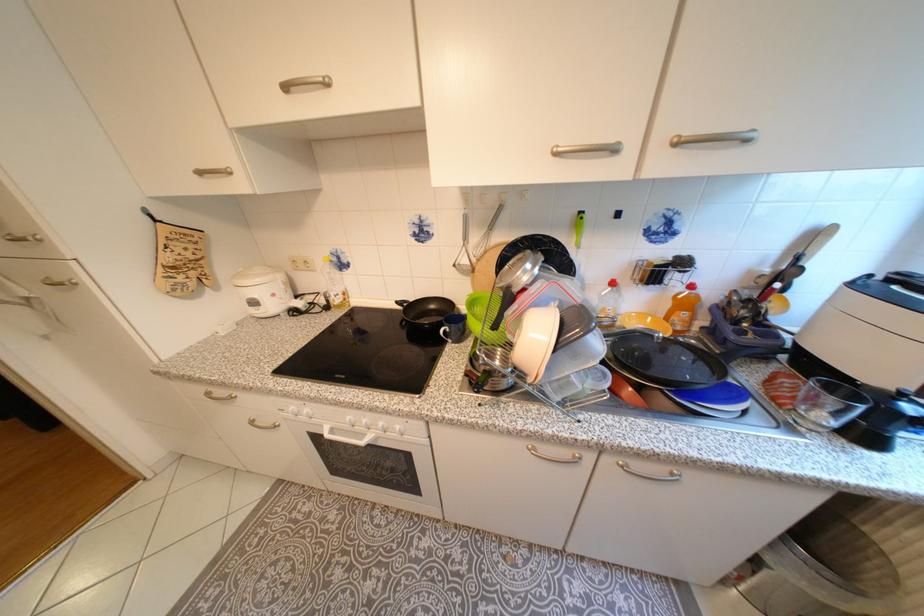
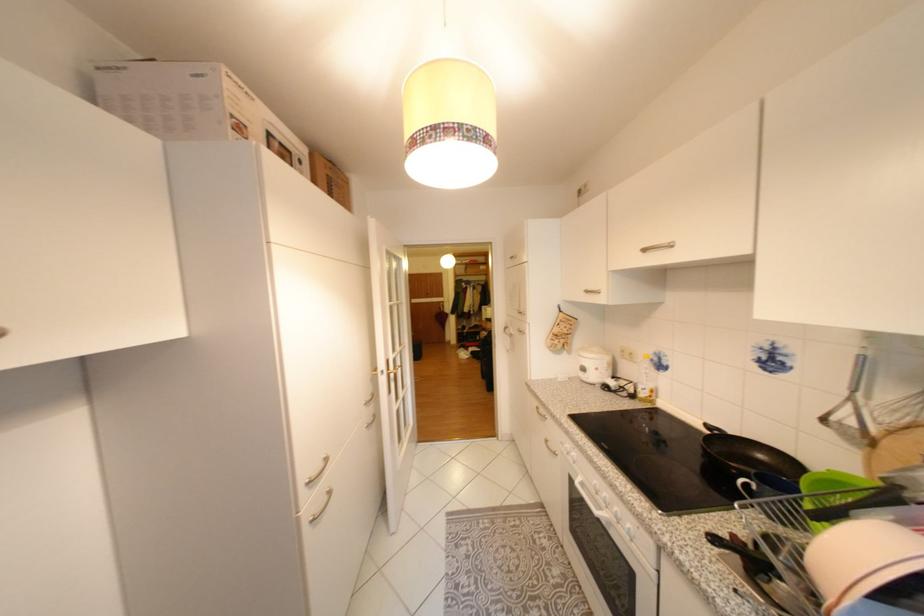
In the second image, find the point that corresponds to (x=371, y=444) in the first image.

(605, 513)